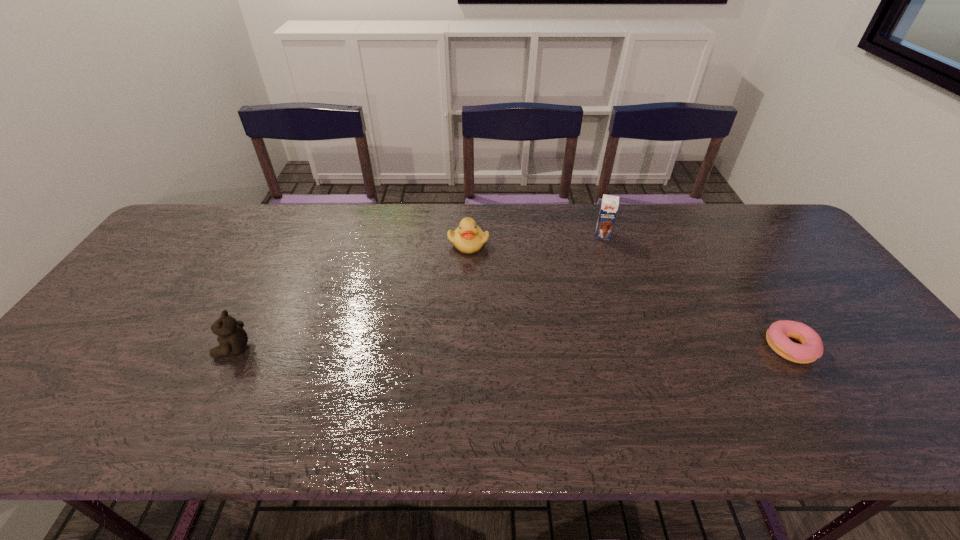
I want to click on empty location between the duckling and the chocolate milk, so click(x=536, y=239).

Image resolution: width=960 pixels, height=540 pixels. Identify the location of vacant space that is in between the tallest object and the doughnut. (697, 292).

Locate an element on the screen. free point between the chocolate milk and the teddy bear is located at coordinates (418, 292).

Image resolution: width=960 pixels, height=540 pixels. I want to click on free point between the shortest object and the chocolate milk, so click(x=697, y=292).

Find the location of a particular element. The width and height of the screenshot is (960, 540). object that is the third closest to the shortest object is located at coordinates (232, 338).

Locate an element on the screen. This screenshot has height=540, width=960. object identified as the closest to the duckling is located at coordinates (x=609, y=206).